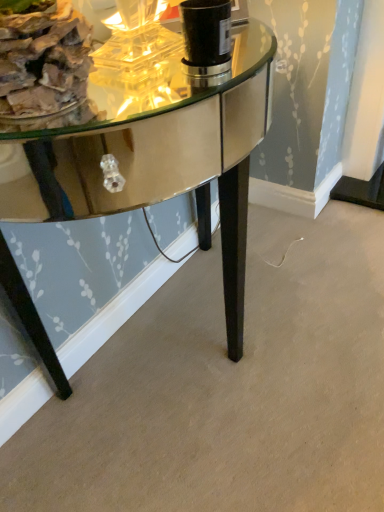
Question: Is wooden logs at left a part of shiny mirrored table at center?

Choices:
 (A) yes
 (B) no

Answer: (B)

Question: Is shiny mirrored table at center bigger than wooden logs at left?

Choices:
 (A) no
 (B) yes

Answer: (B)

Question: Is shiny mirrored table at center next to wooden logs at left?

Choices:
 (A) no
 (B) yes

Answer: (A)

Question: Is shiny mirrored table at center aimed at wooden logs at left?

Choices:
 (A) yes
 (B) no

Answer: (B)

Question: From a real-world perspective, is shiny mirrored table at center over wooden logs at left?

Choices:
 (A) yes
 (B) no

Answer: (B)

Question: Can you confirm if shiny mirrored table at center is smaller than wooden logs at left?

Choices:
 (A) yes
 (B) no

Answer: (B)

Question: Considering the relative sizes of wooden logs at left and shiny mirrored table at center in the image provided, is wooden logs at left bigger than shiny mirrored table at center?

Choices:
 (A) no
 (B) yes

Answer: (A)

Question: Is wooden logs at left facing away from shiny mirrored table at center?

Choices:
 (A) no
 (B) yes

Answer: (A)

Question: Can you confirm if wooden logs at left is thinner than shiny mirrored table at center?

Choices:
 (A) yes
 (B) no

Answer: (A)

Question: From a real-world perspective, is wooden logs at left on shiny mirrored table at center?

Choices:
 (A) no
 (B) yes

Answer: (B)

Question: Is the depth of wooden logs at left less than that of shiny mirrored table at center?

Choices:
 (A) yes
 (B) no

Answer: (B)

Question: Considering the relative sizes of wooden logs at left and shiny mirrored table at center in the image provided, is wooden logs at left taller than shiny mirrored table at center?

Choices:
 (A) no
 (B) yes

Answer: (A)

Question: From the image's perspective, is shiny mirrored table at center positioned above or below wooden logs at left?

Choices:
 (A) above
 (B) below

Answer: (B)